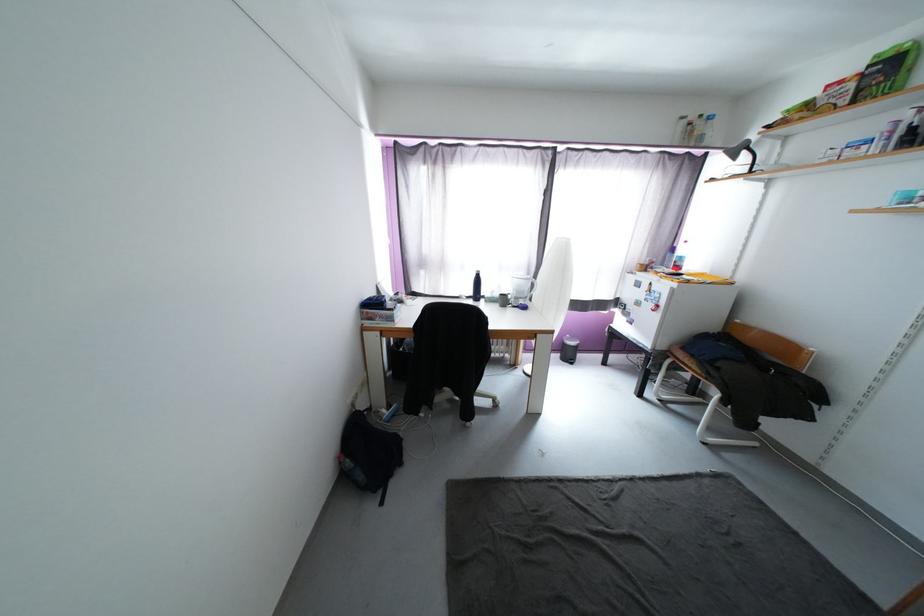
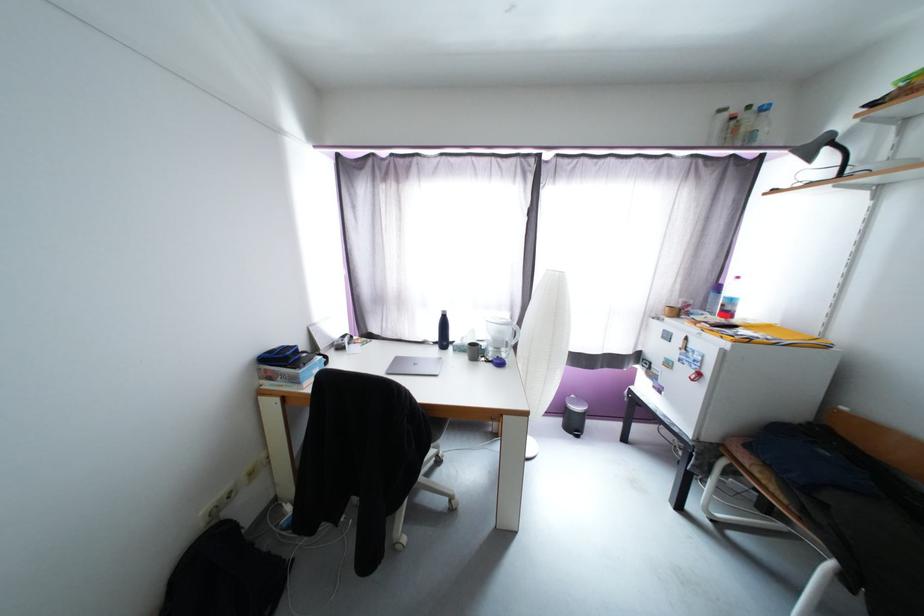
Question: The images are taken continuously from a first-person perspective. In which direction is your viewpoint rotating?

Choices:
 (A) Left
 (B) Right
 (C) Up
 (D) Down

Answer: (C)